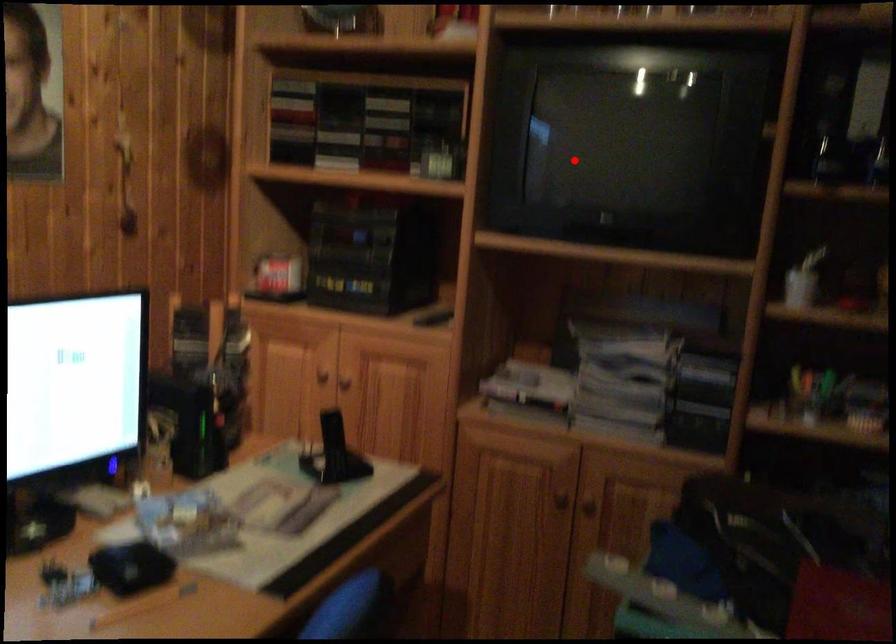
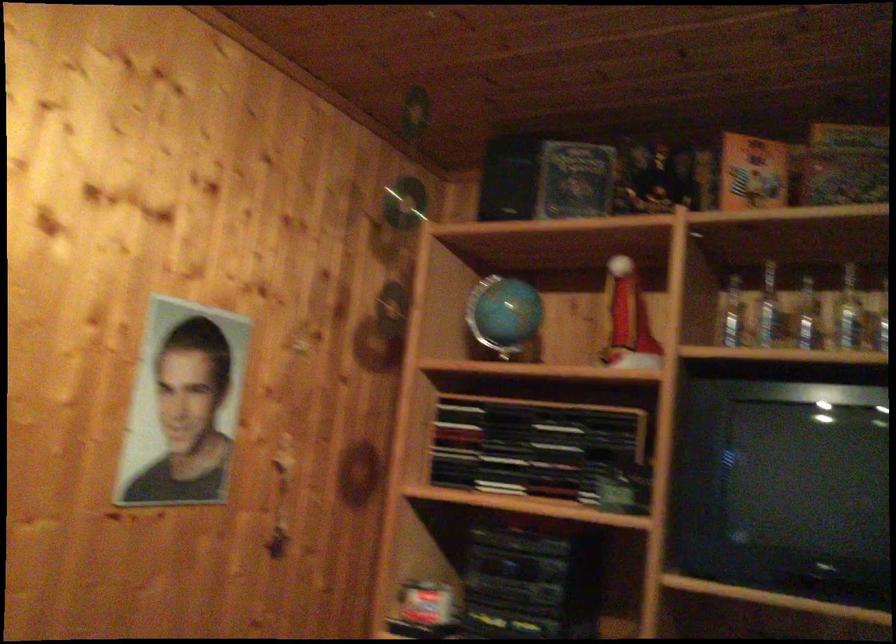
Question: I am providing you with two images of the same scene from different viewpoints. Given a red point in image1, look at the same physical point in image2. Is it:

Choices:
 (A) Closer to the viewpoint
 (B) Farther from the viewpoint

Answer: (A)